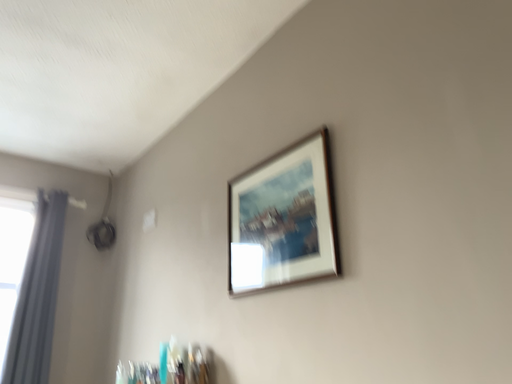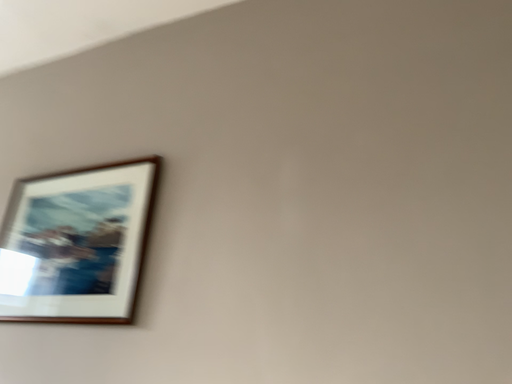
Question: Which way did the camera rotate in the video?

Choices:
 (A) rotated left
 (B) rotated right

Answer: (B)